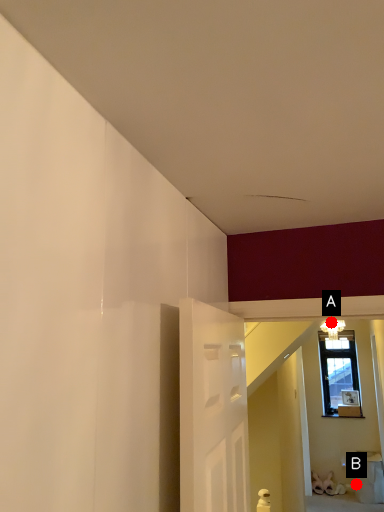
Question: Two points are circled on the image, labeled by A and B beside each circle. Which of the following is the farthest from the observer?

Choices:
 (A) A is further
 (B) B is further

Answer: (A)